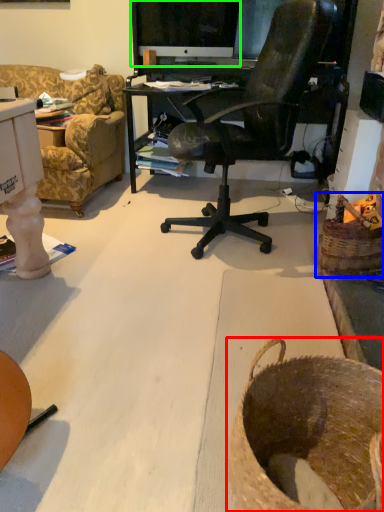
Question: Based on their relative distances, which object is farther from basket (highlighted by a red box)? Choose from basket (highlighted by a blue box) and computer monitor (highlighted by a green box).

Choices:
 (A) basket
 (B) computer monitor

Answer: (B)